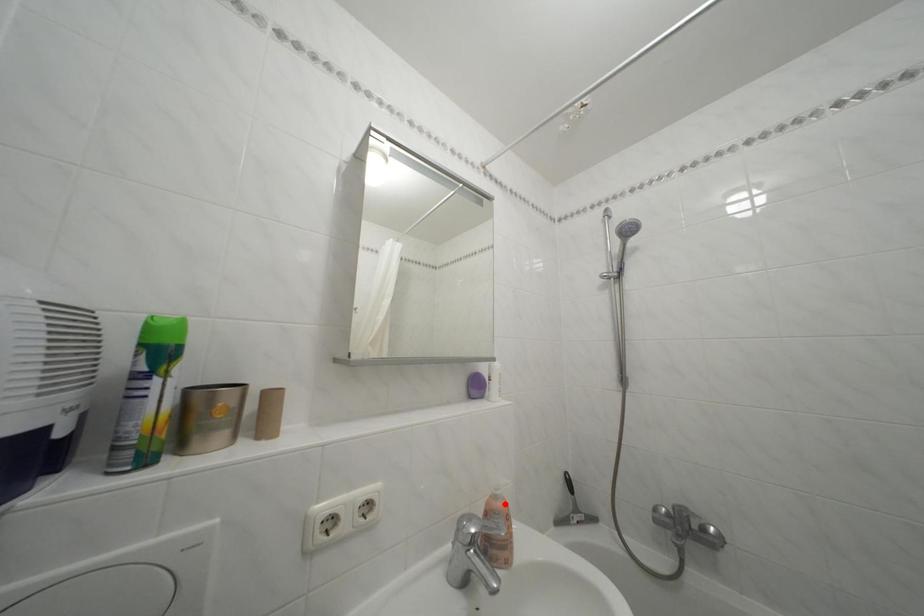
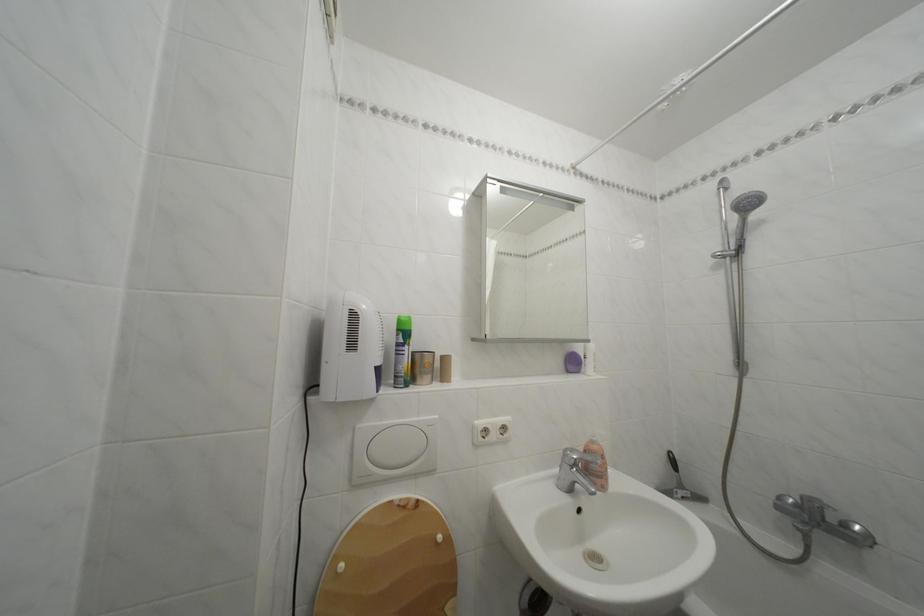
Find the pixel in the second image that matches the highlighted location in the first image.

(602, 448)